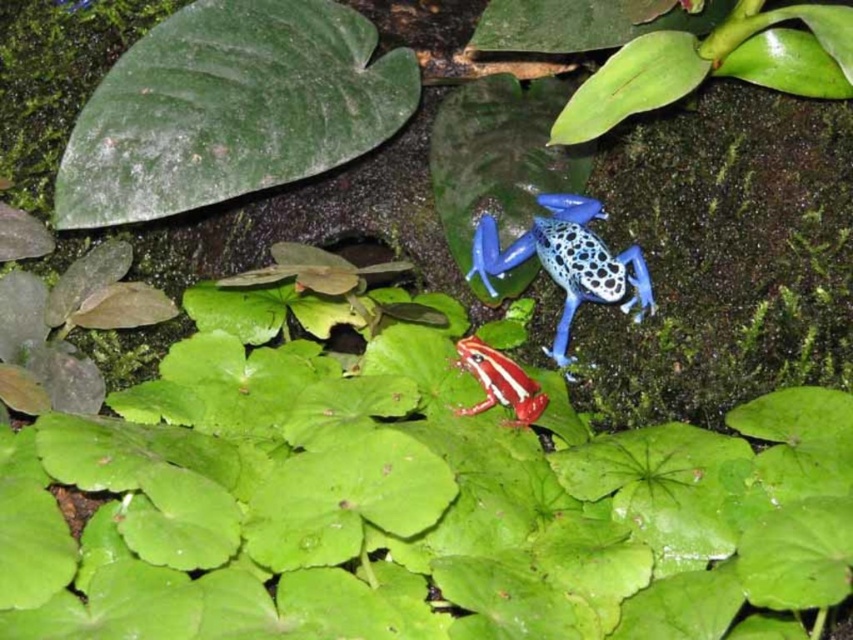
You are an entomologist observing the frogs in the image. You notice both the blue glossy spotted frog at center and the smooth red and white frog at center. Which frog is physically closer to you based on their positions?

The blue glossy spotted frog at center is positioned over the smooth red and white frog at center, so it is closer to you.

You are a researcher studying frog species. You observe the blue glossy spotted frog at center and the smooth red and white frog at center in the image. Which frog has a greater width?

The blue glossy spotted frog at center has a greater width than the smooth red and white frog at center.